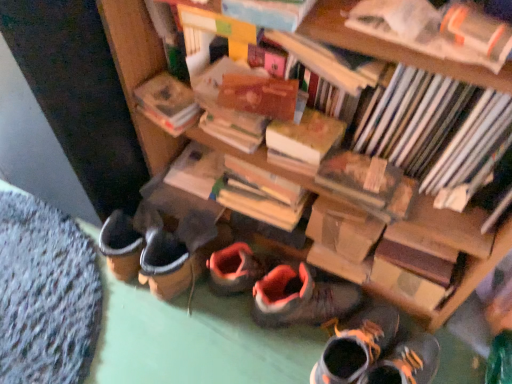
Locate an element on the screen. This screenshot has width=512, height=384. vacant space that is in between orange suede sneaker at center, positioned as the first footwear in left-to-right order, and leather boot at lower center, the 2th footwear positioned from the left is located at coordinates (292, 348).